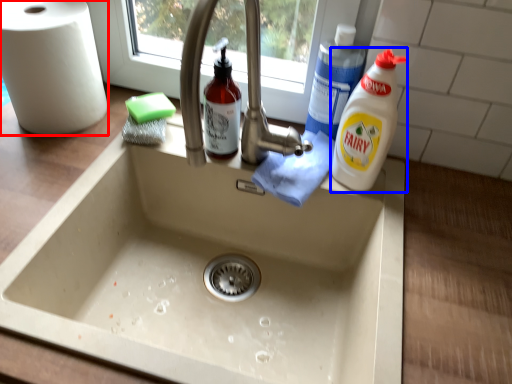
Question: Which point is closer to the camera, paper towel (highlighted by a red box) or cleaning product (highlighted by a blue box)?

Choices:
 (A) paper towel
 (B) cleaning product

Answer: (B)